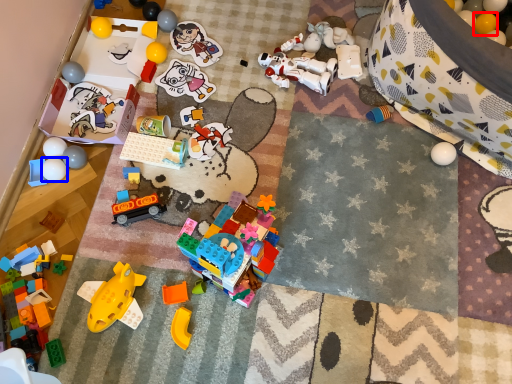
Question: Which object is further to the camera taking this photo, toy (highlighted by a red box) or toy (highlighted by a blue box)?

Choices:
 (A) toy
 (B) toy

Answer: (A)